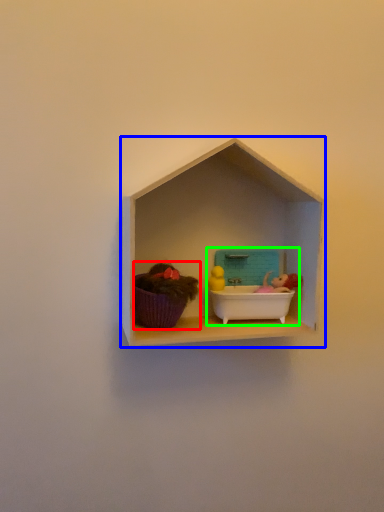
Question: Estimate the real-world distances between objects in this image. Which object is farther from toy (highlighted by a red box), shelf (highlighted by a blue box) or lunch box (highlighted by a green box)?

Choices:
 (A) shelf
 (B) lunch box

Answer: (B)